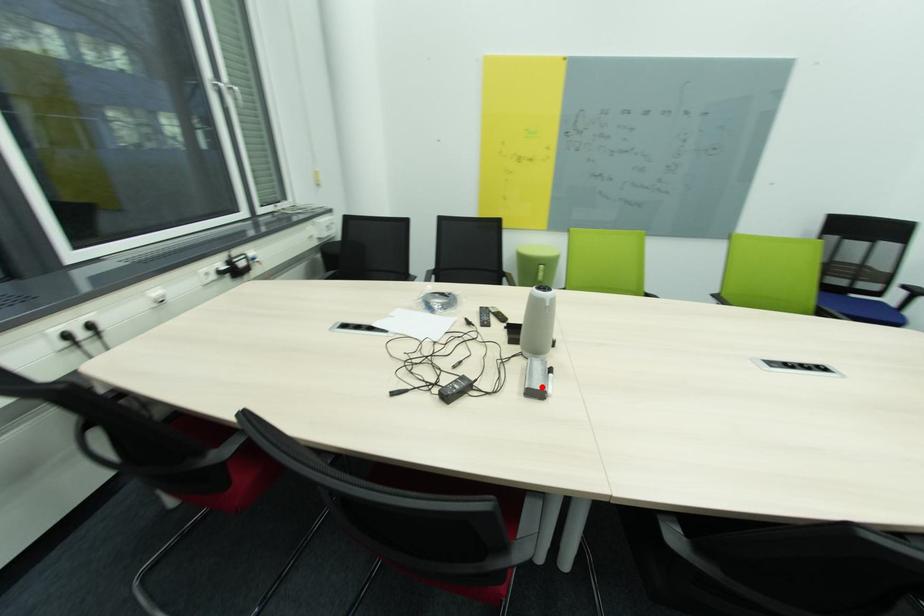
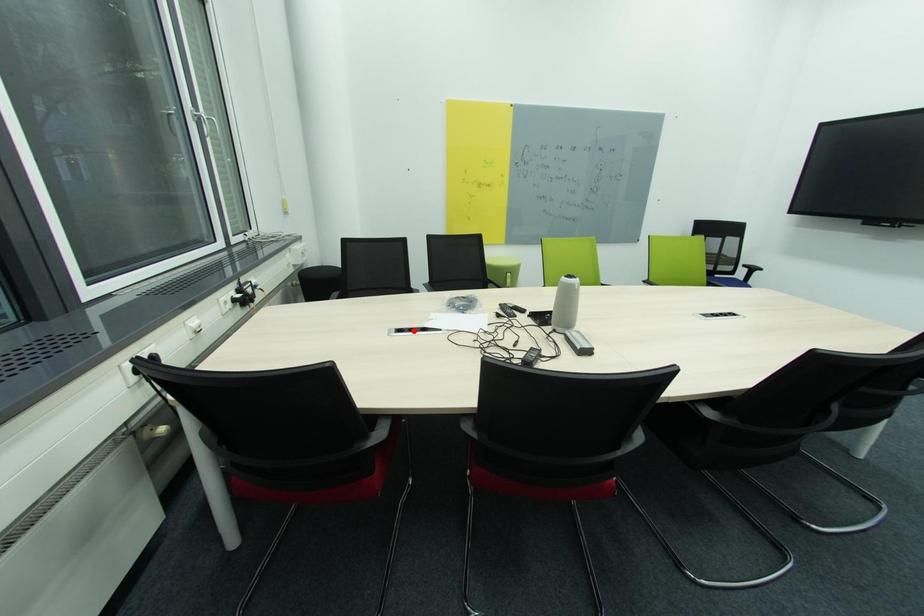
In the scene shown: I am providing you with two images of the same scene from different viewpoints. A red point is marked on the first image and another point is marked on the second image. Are the points marked in image1 and image2 representing the same 3D position?

No